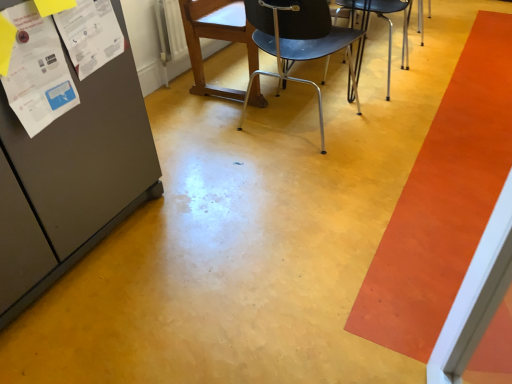
Locate an element on the screen. wooden chair at center, acting as the first chair starting from the left is located at coordinates (216, 38).

In order to face wooden chair at center, acting as the first chair starting from the left, should I rotate leftwards or rightwards?

You should rotate left by 4.619 degrees.

The width and height of the screenshot is (512, 384). Describe the element at coordinates (90, 35) in the screenshot. I see `white paper at upper left, positioned as the first poster in right-to-left order` at that location.

Locate an element on the screen. This screenshot has width=512, height=384. orange smooth carpet at right is located at coordinates (443, 200).

Describe the element at coordinates (443, 200) in the screenshot. I see `orange smooth carpet at right` at that location.

The image size is (512, 384). I want to click on white paper poster at left, the 2th poster viewed from the right, so click(37, 71).

Image resolution: width=512 pixels, height=384 pixels. Identify the location of metallic black chair at center, the first chair when ordered from right to left. (382, 18).

Looking at their sizes, would you say orange smooth carpet at right is wider or thinner than white paper poster at left, which is the 1th poster from left to right?

→ Considering their sizes, orange smooth carpet at right looks broader than white paper poster at left, which is the 1th poster from left to right.

In the scene shown: Is orange smooth carpet at right oriented away from white paper poster at left, the 2th poster viewed from the right?

That's not correct — orange smooth carpet at right is not looking away from white paper poster at left, the 2th poster viewed from the right.

Is orange smooth carpet at right positioned before white paper poster at left, which is the 1th poster from left to right?

No, orange smooth carpet at right is further to the viewer.

Locate an element on the screen. strip that appears below the white paper poster at left, the 2th poster viewed from the right (from a real-world perspective) is located at coordinates (443, 200).

Would you say wooden chair at center, acting as the first chair starting from the left, is inside or outside metallic black chair at center, the first chair when ordered from right to left?

wooden chair at center, acting as the first chair starting from the left, is located beyond the bounds of metallic black chair at center, the first chair when ordered from right to left.

Is wooden chair at center, acting as the first chair starting from the left, facing towards metallic black chair at center, the first chair when ordered from right to left?

Yes, wooden chair at center, acting as the first chair starting from the left, is aimed at metallic black chair at center, the first chair when ordered from right to left.

Measure the distance between wooden chair at center, acting as the first chair starting from the left, and metallic black chair at center, positioned as the third chair in left-to-right order.

They are 77.44 centimeters apart.

Is orange smooth carpet at right shorter than white paper at upper left, which is the 2th poster from left to right?

Correct, orange smooth carpet at right is not as tall as white paper at upper left, which is the 2th poster from left to right.

From the image's perspective, is orange smooth carpet at right on white paper at upper left, which is the 2th poster from left to right?

No, from the image's perspective, orange smooth carpet at right is not over white paper at upper left, which is the 2th poster from left to right.

Which object is more forward, orange smooth carpet at right or white paper at upper left, which is the 2th poster from left to right?

white paper at upper left, which is the 2th poster from left to right.

Which of these two, orange smooth carpet at right or white paper at upper left, which is the 2th poster from left to right, is bigger?

Bigger between the two is orange smooth carpet at right.

Is metallic silver chair at center, acting as the 2th chair starting from the right, far away from white paper poster at left, which is the 1th poster from left to right?

Yes.

Considering the sizes of objects metallic silver chair at center, acting as the 2th chair starting from the right, and white paper poster at left, which is the 1th poster from left to right, in the image provided, who is wider, metallic silver chair at center, acting as the 2th chair starting from the right, or white paper poster at left, which is the 1th poster from left to right,?

metallic silver chair at center, acting as the 2th chair starting from the right.

Could you tell me if metallic silver chair at center, the 2th chair when ordered from left to right, is turned towards white paper poster at left, the 2th poster viewed from the right?

No, metallic silver chair at center, the 2th chair when ordered from left to right, is not facing towards white paper poster at left, the 2th poster viewed from the right.

Can you tell me how much metallic silver chair at center, acting as the 2th chair starting from the right, and white paper poster at left, the 2th poster viewed from the right, differ in facing direction?

80 degrees separate the facing orientations of metallic silver chair at center, acting as the 2th chair starting from the right, and white paper poster at left, the 2th poster viewed from the right.

Considering the sizes of objects metallic black chair at center, positioned as the third chair in left-to-right order, and wooden chair at center, marked as the third chair in a right-to-left arrangement, in the image provided, who is taller, metallic black chair at center, positioned as the third chair in left-to-right order, or wooden chair at center, marked as the third chair in a right-to-left arrangement,?

Standing taller between the two is wooden chair at center, marked as the third chair in a right-to-left arrangement.

Does metallic black chair at center, the first chair when ordered from right to left, have a smaller size compared to wooden chair at center, marked as the third chair in a right-to-left arrangement?

No.

Relative to wooden chair at center, marked as the third chair in a right-to-left arrangement, is metallic black chair at center, the first chair when ordered from right to left, in front or behind?

Clearly, metallic black chair at center, the first chair when ordered from right to left, is in front of wooden chair at center, marked as the third chair in a right-to-left arrangement.

Find the location of a particular element. chair behind the metallic black chair at center, the first chair when ordered from right to left is located at coordinates (216, 38).

Which is more to the right, white paper at upper left, positioned as the first poster in right-to-left order, or metallic silver chair at center, the 2th chair when ordered from left to right?

From the viewer's perspective, metallic silver chair at center, the 2th chair when ordered from left to right, appears more on the right side.

Between white paper at upper left, which is the 2th poster from left to right, and metallic silver chair at center, acting as the 2th chair starting from the right, which one has smaller size?

white paper at upper left, which is the 2th poster from left to right.

Could you measure the distance between white paper at upper left, positioned as the first poster in right-to-left order, and metallic silver chair at center, acting as the 2th chair starting from the right?

white paper at upper left, positioned as the first poster in right-to-left order, and metallic silver chair at center, acting as the 2th chair starting from the right, are 32.69 inches apart.

Is white paper at upper left, which is the 2th poster from left to right, taller than metallic silver chair at center, the 2th chair when ordered from left to right?

Incorrect, the height of white paper at upper left, which is the 2th poster from left to right, is not larger of that of metallic silver chair at center, the 2th chair when ordered from left to right.

Considering the positions of points (429, 284) and (385, 10), is point (429, 284) closer to camera compared to point (385, 10)?

Yes, it is in front of point (385, 10).

From the image's perspective, starting from the orange smooth carpet at right, which chair is the 3rd one above? Please provide its 2D coordinates.

[(382, 18)]

Is metallic black chair at center, positioned as the third chair in left-to-right order, at the back of orange smooth carpet at right?

No, orange smooth carpet at right's orientation is not away from metallic black chair at center, positioned as the third chair in left-to-right order.

Locate an element on the screen. The height and width of the screenshot is (384, 512). strip located on the right of white paper poster at left, the 2th poster viewed from the right is located at coordinates (443, 200).

Where is `chair above the wooden chair at center, marked as the third chair in a right-to-left arrangement (from the image's perspective)`? The image size is (512, 384). chair above the wooden chair at center, marked as the third chair in a right-to-left arrangement (from the image's perspective) is located at coordinates (382, 18).

Which object lies nearer to the anchor point metallic black chair at center, the first chair when ordered from right to left, white paper poster at left, the 2th poster viewed from the right, or metallic silver chair at center, the 2th chair when ordered from left to right?

metallic silver chair at center, the 2th chair when ordered from left to right, lies closer to metallic black chair at center, the first chair when ordered from right to left, than the other object.

When comparing their distances from white paper at upper left, which is the 2th poster from left to right, does orange smooth carpet at right or wooden chair at center, marked as the third chair in a right-to-left arrangement, seem closer?

wooden chair at center, marked as the third chair in a right-to-left arrangement, is closer to white paper at upper left, which is the 2th poster from left to right.

Which object lies nearer to the anchor point white paper poster at left, which is the 1th poster from left to right, metallic black chair at center, the first chair when ordered from right to left, or wooden chair at center, marked as the third chair in a right-to-left arrangement?

wooden chair at center, marked as the third chair in a right-to-left arrangement, lies closer to white paper poster at left, which is the 1th poster from left to right, than the other object.

Estimate the real-world distances between objects in this image. Which object is further from white paper poster at left, the 2th poster viewed from the right, white paper at upper left, positioned as the first poster in right-to-left order, or orange smooth carpet at right?

The object further to white paper poster at left, the 2th poster viewed from the right, is orange smooth carpet at right.

When comparing their distances from metallic black chair at center, positioned as the third chair in left-to-right order, does white paper at upper left, which is the 2th poster from left to right, or white paper poster at left, the 2th poster viewed from the right, seem further?

white paper poster at left, the 2th poster viewed from the right, is positioned further to the anchor metallic black chair at center, positioned as the third chair in left-to-right order.

Looking at the image, which one is located further to white paper poster at left, which is the 1th poster from left to right, metallic silver chair at center, acting as the 2th chair starting from the right, or orange smooth carpet at right?

orange smooth carpet at right.

Estimate the real-world distances between objects in this image. Which object is closer to white paper poster at left, the 2th poster viewed from the right, metallic silver chair at center, acting as the 2th chair starting from the right, or wooden chair at center, marked as the third chair in a right-to-left arrangement?

metallic silver chair at center, acting as the 2th chair starting from the right.

Looking at the image, which one is located closer to white paper poster at left, the 2th poster viewed from the right, metallic black chair at center, positioned as the third chair in left-to-right order, or orange smooth carpet at right?

Based on the image, orange smooth carpet at right appears to be nearer to white paper poster at left, the 2th poster viewed from the right.

I want to click on chair located between wooden chair at center, acting as the first chair starting from the left, and metallic black chair at center, positioned as the third chair in left-to-right order, in the left-right direction, so click(x=297, y=41).

The width and height of the screenshot is (512, 384). I want to click on poster between white paper poster at left, which is the 1th poster from left to right, and metallic black chair at center, positioned as the third chair in left-to-right order, in the horizontal direction, so click(90, 35).

Where is `chair situated between metallic silver chair at center, the 2th chair when ordered from left to right, and orange smooth carpet at right from left to right`? This screenshot has height=384, width=512. chair situated between metallic silver chair at center, the 2th chair when ordered from left to right, and orange smooth carpet at right from left to right is located at coordinates (382, 18).

I want to click on poster located between white paper poster at left, which is the 1th poster from left to right, and metallic silver chair at center, the 2th chair when ordered from left to right, in the left-right direction, so click(x=90, y=35).